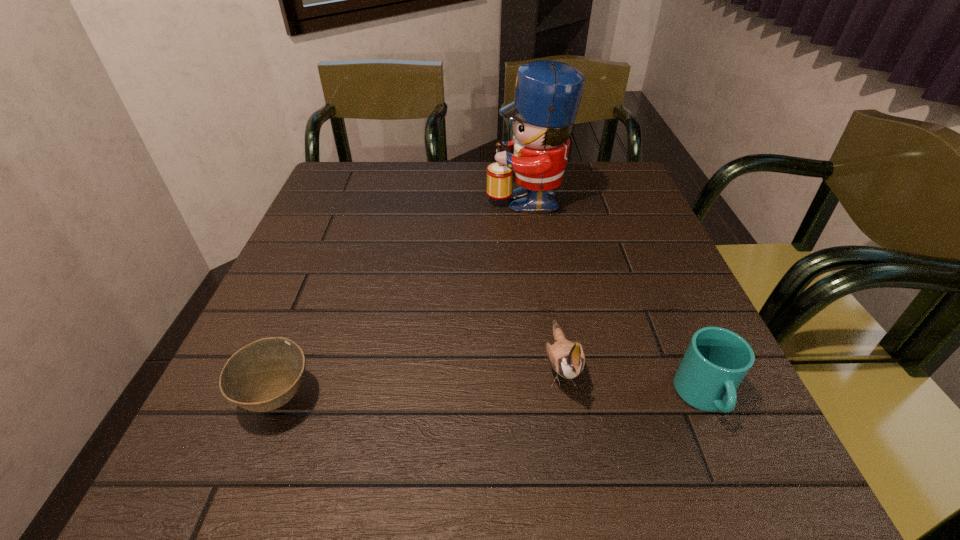
This screenshot has width=960, height=540. I want to click on the third closest object to the cup, so click(x=264, y=375).

Choose which object is the third nearest neighbor to the second shortest object. Please provide its 2D coordinates. Your answer should be formatted as a tuple, i.e. [(x, y)], where the tuple contains the x and y coordinates of a point satisfying the conditions above.

[(264, 375)]